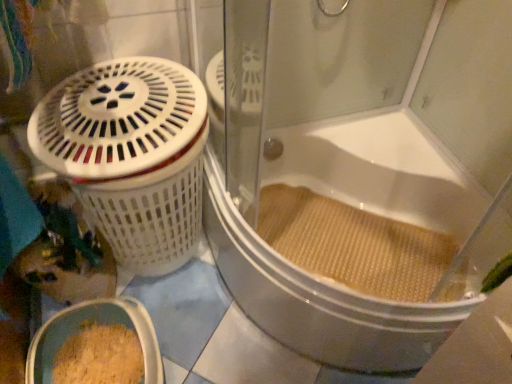
Describe the element at coordinates (353, 244) in the screenshot. I see `beige textured mat at lower right` at that location.

I want to click on white plastic basket at left, so click(131, 155).

Is white textured bathtub at center facing towards beige textured mat at lower right?

No.

Which is in front, point (317, 130) or point (423, 264)?

Positioned in front is point (423, 264).

From a real-world perspective, is white textured bathtub at center physically located above or below beige textured mat at lower right?

In terms of real-world spatial position, white textured bathtub at center is above beige textured mat at lower right.

Is beige textured mat at lower right directly adjacent to white plastic basket at left?

No, beige textured mat at lower right is not next to white plastic basket at left.

From the image's perspective, is beige textured mat at lower right above or below white plastic basket at left?

beige textured mat at lower right is situated lower than white plastic basket at left in the image.

Based on their positions, is beige textured mat at lower right located to the left or right of white plastic basket at left?

beige textured mat at lower right is positioned on white plastic basket at left's right side.

Can you confirm if beige textured mat at lower right is wider than white plastic basket at left?

In fact, beige textured mat at lower right might be narrower than white plastic basket at left.

Which of these two, beige textured mat at lower right or white textured bathtub at center, is thinner?

Thinner between the two is beige textured mat at lower right.

Considering the sizes of objects beige textured mat at lower right and white textured bathtub at center in the image provided, who is taller, beige textured mat at lower right or white textured bathtub at center?

white textured bathtub at center.

Is beige textured mat at lower right situated inside white textured bathtub at center or outside?

The correct answer is: inside.

How much distance is there between white plastic basket at left and white textured bathtub at center?

white plastic basket at left and white textured bathtub at center are 14.33 inches apart from each other.

From the image's perspective, is white plastic basket at left beneath white textured bathtub at center?

Yes, from the image's perspective, white plastic basket at left is below white textured bathtub at center.

This screenshot has height=384, width=512. In order to click on bathtub above the white plastic basket at left (from a real-world perspective) in this screenshot , I will do (x=324, y=299).

Considering the relative sizes of white plastic basket at left and white textured bathtub at center in the image provided, is white plastic basket at left smaller than white textured bathtub at center?

Yes, white plastic basket at left is smaller than white textured bathtub at center.

Is white textured bathtub at center situated inside white plastic basket at left or outside?

white textured bathtub at center is located beyond the bounds of white plastic basket at left.

Could you tell me if white textured bathtub at center is turned towards white plastic basket at left?

Yes, white textured bathtub at center is facing white plastic basket at left.

Is point (431, 196) closer to viewer compared to point (170, 141)?

That is False.

How many degrees apart are the facing directions of white textured bathtub at center and white plastic basket at left?

There is a 90-degree angle between the facing directions of white textured bathtub at center and white plastic basket at left.

Is white plastic basket at left in front of or behind beige textured mat at lower right in the image?

white plastic basket at left is in front of beige textured mat at lower right.

Is white plastic basket at left not close to beige textured mat at lower right?

No.

How distant is white plastic basket at left from beige textured mat at lower right?

A distance of 19.69 inches exists between white plastic basket at left and beige textured mat at lower right.

The height and width of the screenshot is (384, 512). In order to click on bathtub located above the beige textured mat at lower right (from a real-world perspective) in this screenshot , I will do `click(324, 299)`.

Identify the location of basket container in front of the beige textured mat at lower right. This screenshot has height=384, width=512. (131, 155).

From the image, which object appears to be nearer to white plastic basket at left, white textured bathtub at center or beige textured mat at lower right?

white textured bathtub at center lies closer to white plastic basket at left than the other object.

From the picture: Looking at the image, which one is located further to white textured bathtub at center, white plastic basket at left or beige textured mat at lower right?

Among the two, white plastic basket at left is located further to white textured bathtub at center.

From the image, which object appears to be farther from white textured bathtub at center, beige textured mat at lower right or white plastic basket at left?

white plastic basket at left.

Considering their positions, is white textured bathtub at center positioned closer to beige textured mat at lower right than white plastic basket at left?

white textured bathtub at center is positioned closer to the anchor beige textured mat at lower right.

From the image, which object appears to be farther from white plastic basket at left, beige textured mat at lower right or white textured bathtub at center?

beige textured mat at lower right is further to white plastic basket at left.

Considering their positions, is white plastic basket at left positioned further to beige textured mat at lower right than white textured bathtub at center?

Among the two, white plastic basket at left is located further to beige textured mat at lower right.

This screenshot has width=512, height=384. I want to click on basket container between white textured bathtub at center and beige textured mat at lower right from front to back, so click(x=131, y=155).